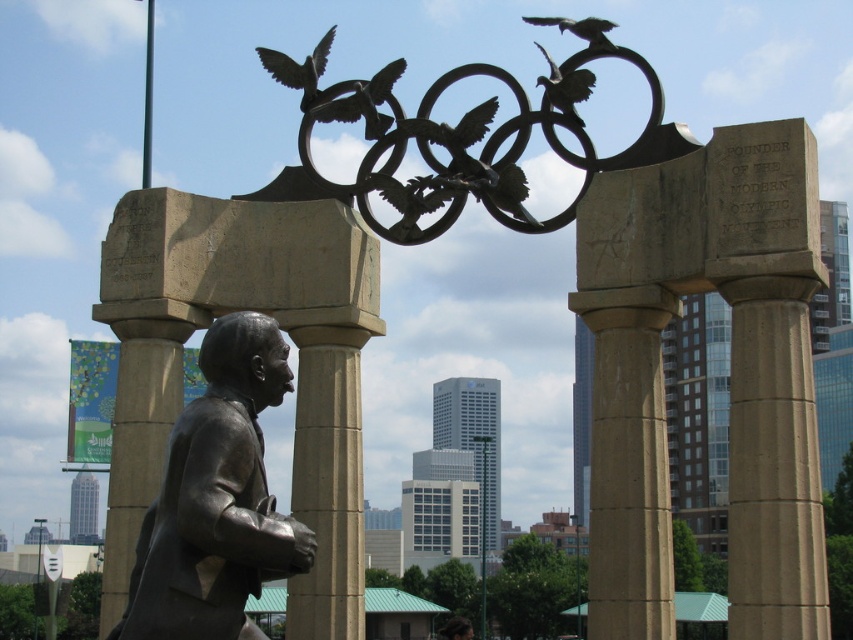
The height and width of the screenshot is (640, 853). I want to click on shiny silver bird at upper center, so click(358, 100).

The image size is (853, 640). What do you see at coordinates (358, 100) in the screenshot?
I see `shiny silver bird at upper center` at bounding box center [358, 100].

This screenshot has height=640, width=853. I want to click on shiny silver bird at upper center, so click(x=358, y=100).

Which is above, bronze textured eagle at upper center or bronze sculpture of bird at upper center?

bronze sculpture of bird at upper center

Measure the distance between bronze textured eagle at upper center and bronze sculpture of bird at upper center.

The distance of bronze textured eagle at upper center from bronze sculpture of bird at upper center is 8.51 meters.

This screenshot has height=640, width=853. In order to click on bronze textured eagle at upper center in this screenshot , I will do `click(416, 205)`.

Does black metal olympic rings at center lie in front of bronze textured bird at upper center?

Yes, it is.

Is black metal olympic rings at center shorter than bronze textured bird at upper center?

No.

Between point (389, 93) and point (552, 76), which one is positioned in front?

Point (552, 76) is in front.

Where is `black metal olympic rings at center`? black metal olympic rings at center is located at coordinates [x=457, y=140].